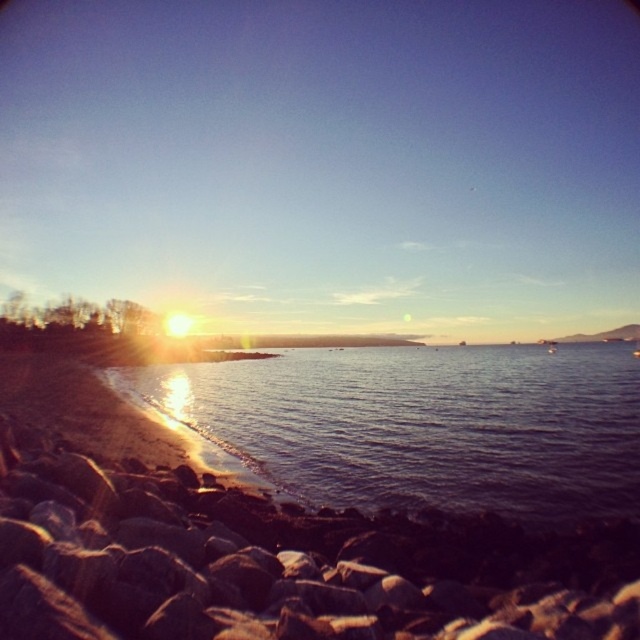
Based on the photo, you are standing on the smooth gray rock at lower left and want to step onto the shiny blue water at lower left. Considering their heights, will your foot touch the water when you step down?

The smooth gray rock at lower left has a greater height compared to shiny blue water at lower left, so when you step down from the smooth gray rock at lower left to the shiny blue water at lower left, your foot will touch the water.

You are a photographer standing at the edge of the shoreline. You want to capture a photo of the smooth gray rock at lower left and the shiny blue water at lower left. Which object is closer to you, the photographer?

The smooth gray rock at lower left is positioned over the shiny blue water at lower left, meaning the smooth gray rock at lower left is closer to you.